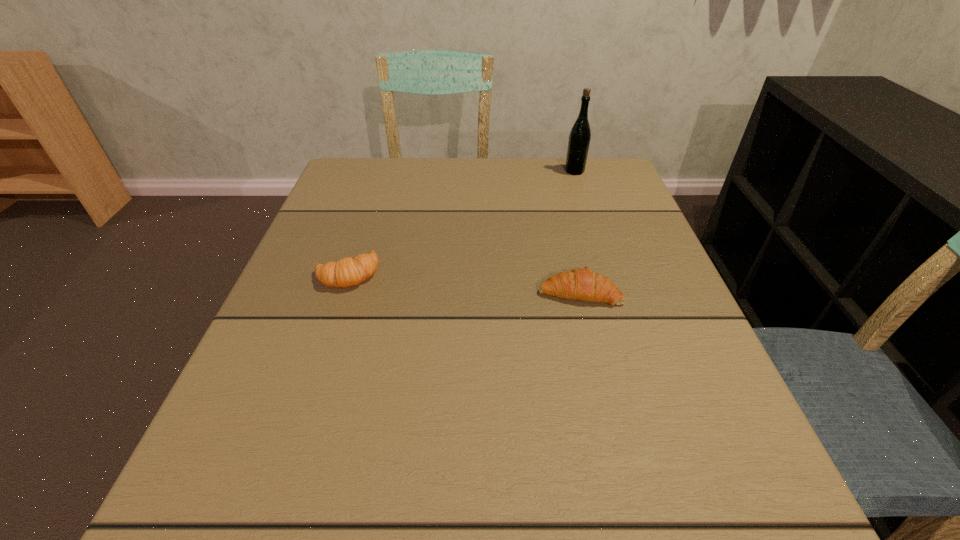
Find the location of `vacant space that is in between the farthest object and the left crescent roll`. vacant space that is in between the farthest object and the left crescent roll is located at coordinates (461, 222).

In order to click on free space between the right crescent roll and the leftmost object in this screenshot , I will do `click(464, 282)`.

The width and height of the screenshot is (960, 540). In order to click on free spot between the left crescent roll and the farthest object in this screenshot , I will do `click(461, 222)`.

This screenshot has width=960, height=540. In order to click on free area in between the right crescent roll and the farthest object in this screenshot , I will do `click(577, 232)`.

This screenshot has height=540, width=960. What are the coordinates of `vacant space that's between the farthest object and the right crescent roll` in the screenshot? It's located at (577, 232).

What are the coordinates of `empty location between the farthest object and the right crescent roll` in the screenshot? It's located at (577, 232).

Locate an element on the screen. This screenshot has width=960, height=540. vacant area that lies between the left crescent roll and the right crescent roll is located at coordinates (464, 282).

Locate an element on the screen. empty location between the right crescent roll and the tallest object is located at coordinates (577, 232).

The image size is (960, 540). In order to click on object that is the second closest one to the right crescent roll in this screenshot , I will do `click(579, 139)`.

Identify which object is located as the nearest to the right crescent roll. Please provide its 2D coordinates. Your answer should be formatted as a tuple, i.e. [(x, y)], where the tuple contains the x and y coordinates of a point satisfying the conditions above.

[(346, 272)]